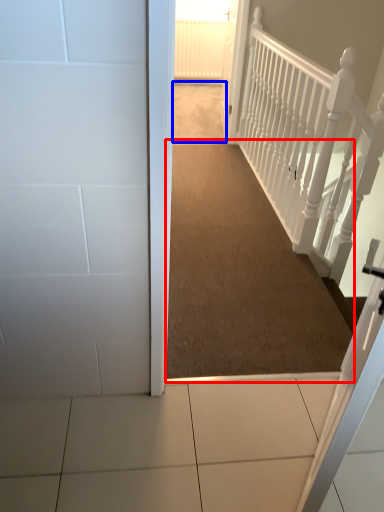
Question: Which of the following is the farthest to the observer, corridor (highlighted by a red box) or path (highlighted by a blue box)?

Choices:
 (A) corridor
 (B) path

Answer: (B)